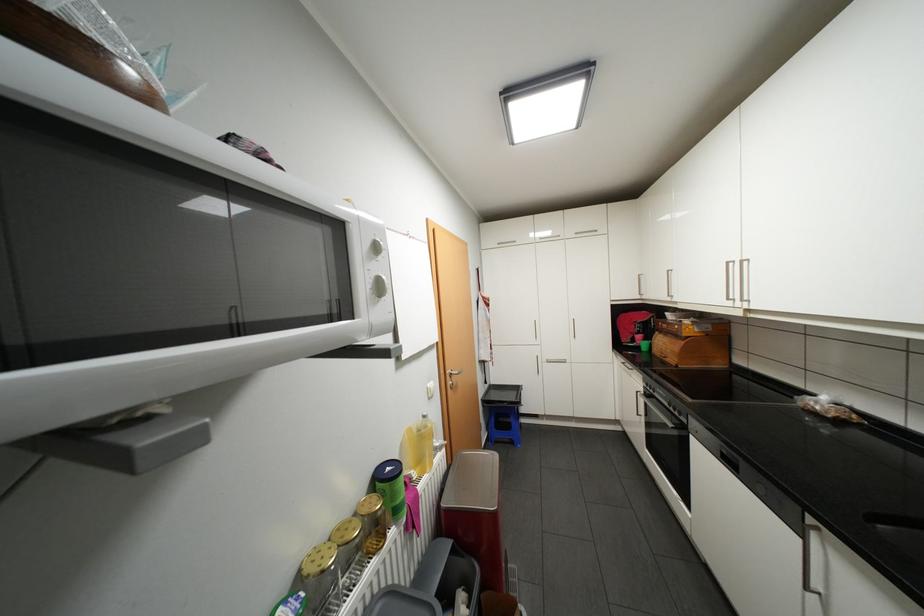
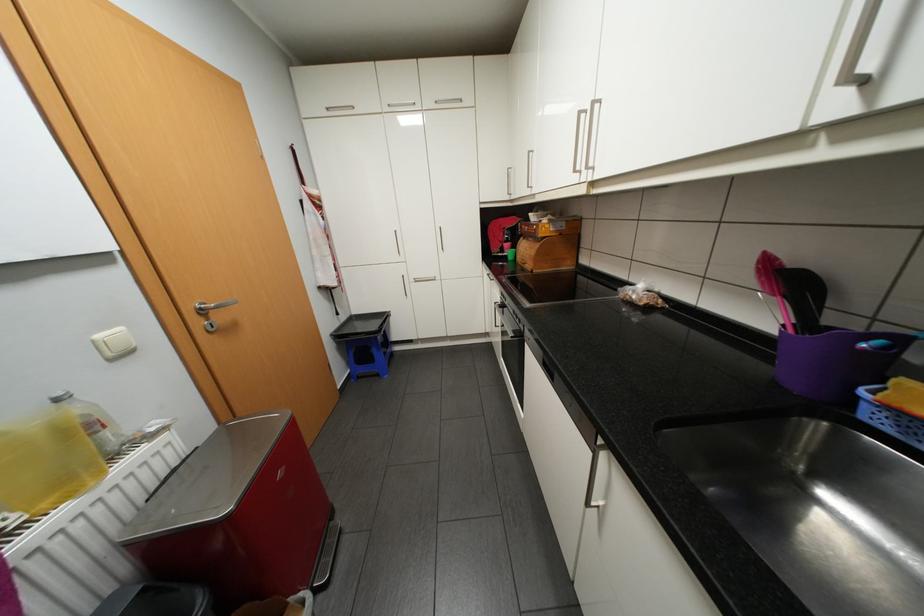
The point at (667, 331) is marked in the first image. Where is the corresponding point in the second image?

(531, 237)